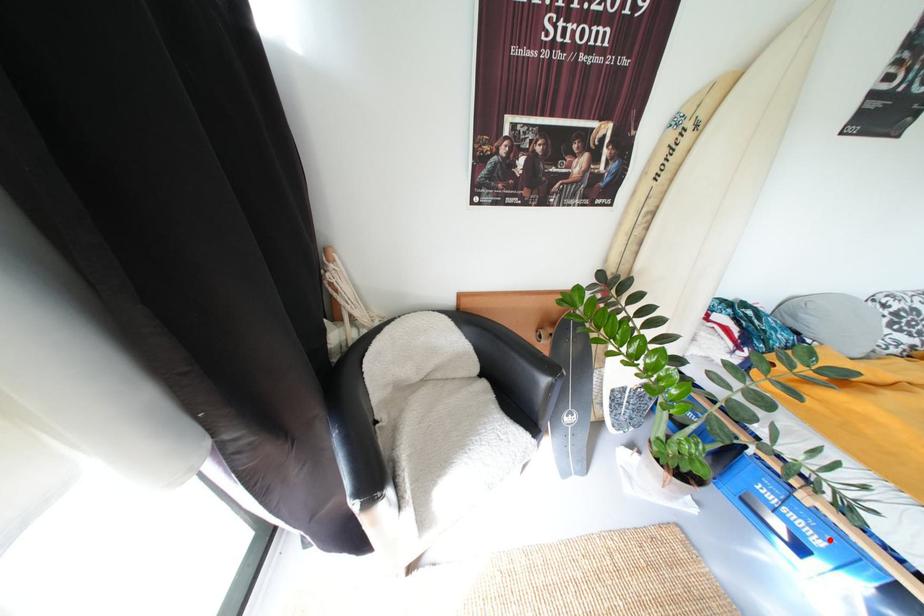
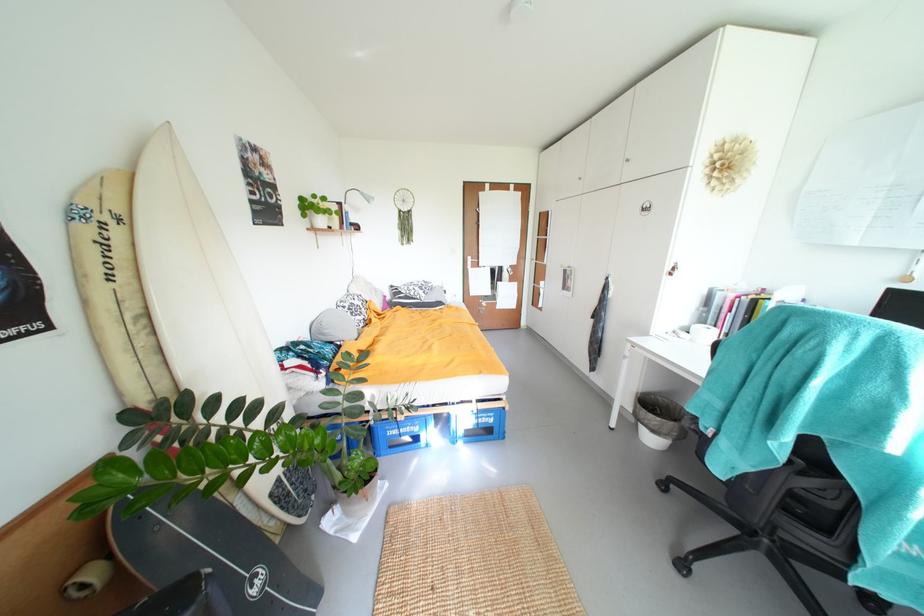
Find the pixel in the second image that matches the highlighted location in the first image.

(423, 428)